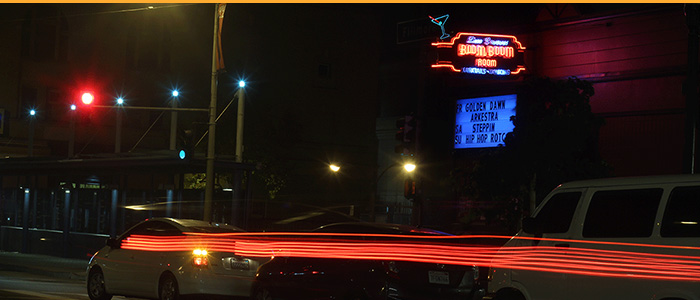
Find the location of a particular element. The width and height of the screenshot is (700, 300). blue lights is located at coordinates (176, 92), (242, 84), (119, 99), (71, 108), (31, 112).